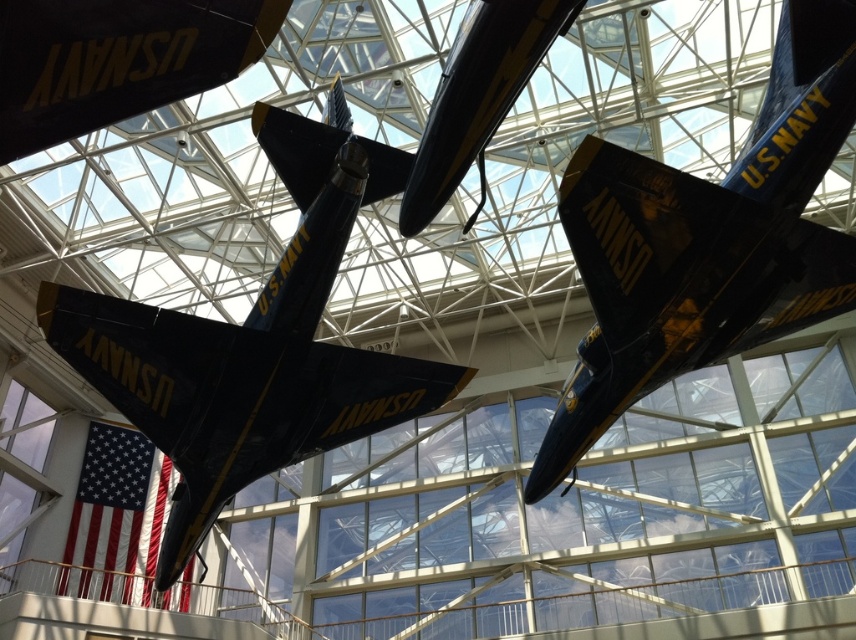
Question: Does glossy black airplane at upper center appear under shiny black airplane at center?

Choices:
 (A) yes
 (B) no

Answer: (B)

Question: Which point is closer to the camera?

Choices:
 (A) glossy black airplane at upper center
 (B) shiny black airplane at center

Answer: (A)

Question: Which point is farther to the camera?

Choices:
 (A) (575, 371)
 (B) (358, 406)

Answer: (A)

Question: Does glossy black airplane at upper center have a smaller size compared to shiny black airplane at center?

Choices:
 (A) yes
 (B) no

Answer: (A)

Question: Does glossy black airplane at upper center have a larger size compared to shiny black airplane at center?

Choices:
 (A) no
 (B) yes

Answer: (A)